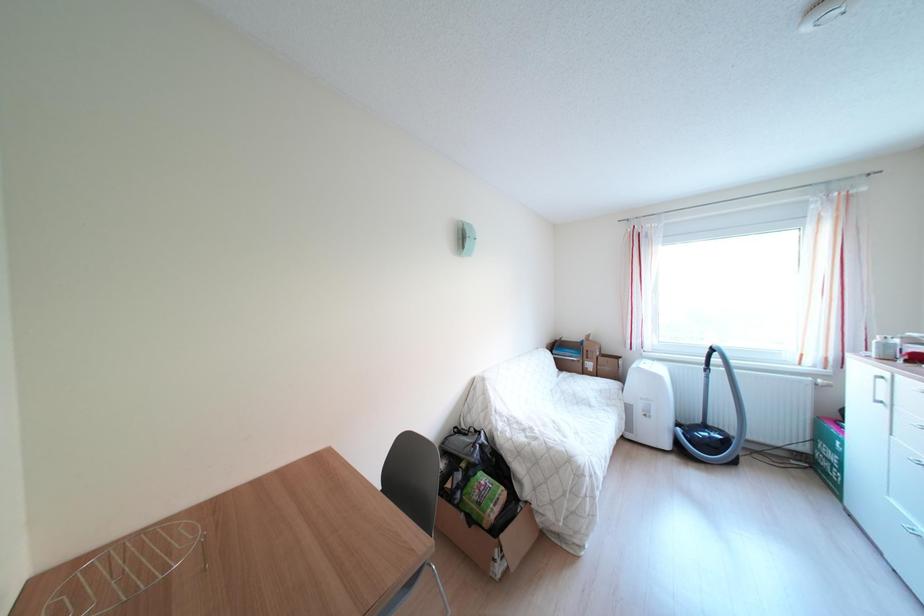
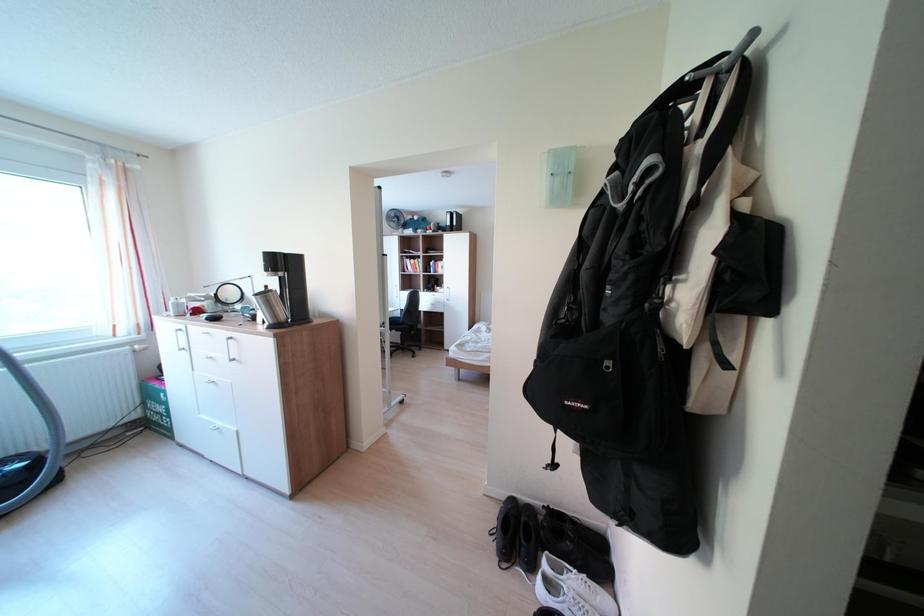
Question: The camera is either moving clockwise (left) or counter-clockwise (right) around the object. The first image is from the beginning of the video and the second image is from the end. Is the camera moving left or right when shooting the video?

Choices:
 (A) Left
 (B) Right

Answer: (A)